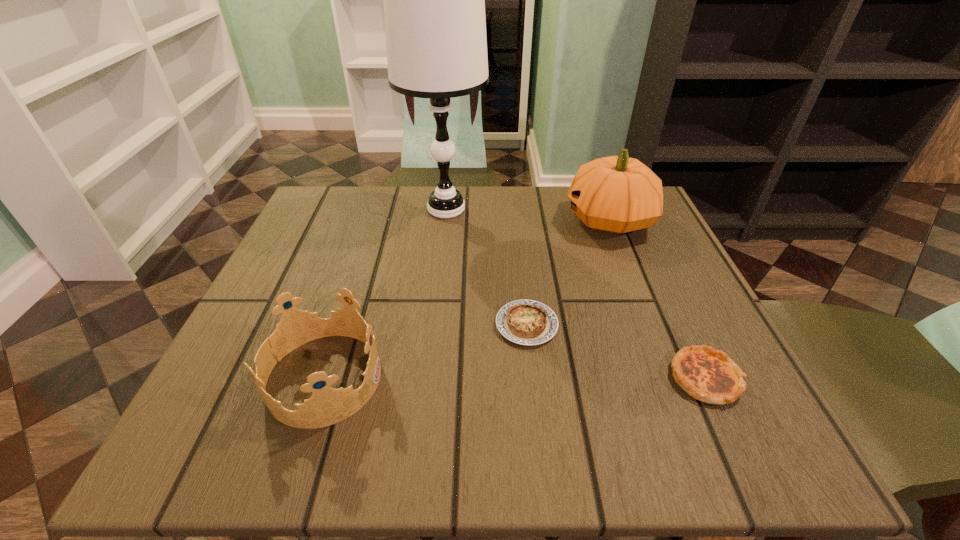
Where is `free space located on the front-facing side of the third tallest object`? The width and height of the screenshot is (960, 540). free space located on the front-facing side of the third tallest object is located at coordinates (444, 378).

The width and height of the screenshot is (960, 540). Identify the location of vacant space positioned on the back of the nearer quiche. (675, 312).

Locate an element on the screen. free point located on the back of the farther quiche is located at coordinates (520, 262).

Where is `table lamp that is positioned at the far edge`? This screenshot has width=960, height=540. table lamp that is positioned at the far edge is located at coordinates (434, 0).

Where is `gourd at the far edge`? The width and height of the screenshot is (960, 540). gourd at the far edge is located at coordinates (617, 194).

The width and height of the screenshot is (960, 540). I want to click on tiara that is at the near edge, so click(327, 406).

Where is `quiche located at the near edge`? The height and width of the screenshot is (540, 960). quiche located at the near edge is located at coordinates (708, 375).

This screenshot has width=960, height=540. I want to click on object located at the left edge, so pyautogui.click(x=327, y=406).

At what (x,y) coordinates should I click in order to perform the action: click on gourd that is at the right edge. Please return your answer as a coordinate pair (x, y). The height and width of the screenshot is (540, 960). Looking at the image, I should click on (617, 194).

I want to click on quiche that is at the right edge, so click(x=708, y=375).